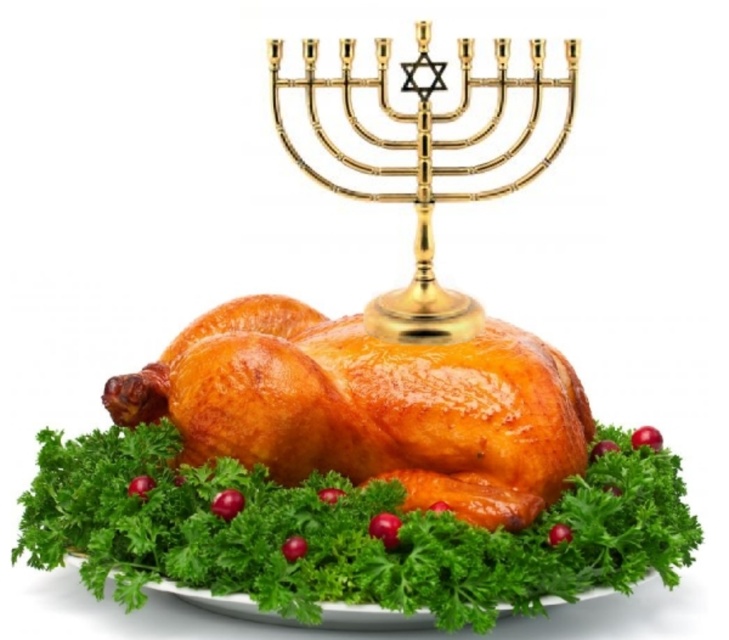
Question: Is the position of golden crispy turkey at center less distant than that of gold polished menorah at upper center?

Choices:
 (A) no
 (B) yes

Answer: (B)

Question: Which object appears closest to the camera in this image?

Choices:
 (A) gold polished menorah at upper center
 (B) golden crispy turkey at center

Answer: (B)

Question: Among these objects, which one is farthest from the camera?

Choices:
 (A) golden crispy turkey at center
 (B) gold polished menorah at upper center

Answer: (B)

Question: Is golden crispy turkey at center above gold polished menorah at upper center?

Choices:
 (A) no
 (B) yes

Answer: (A)

Question: Among these points, which one is farthest from the camera?

Choices:
 (A) (486, 83)
 (B) (499, 448)

Answer: (A)

Question: Can you confirm if golden crispy turkey at center is positioned above gold polished menorah at upper center?

Choices:
 (A) no
 (B) yes

Answer: (A)